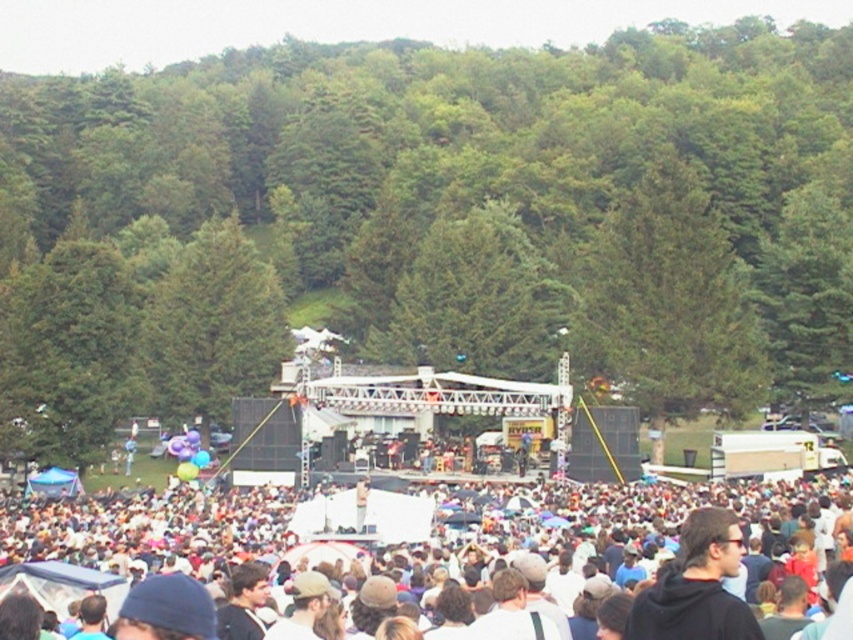
Who is higher up, white cotton crowd at center or black hoodie at center?

Positioned higher is black hoodie at center.

Who is more distant from viewer, (x=277, y=500) or (x=699, y=627)?

Positioned behind is point (x=277, y=500).

The height and width of the screenshot is (640, 853). I want to click on white cotton crowd at center, so click(622, 522).